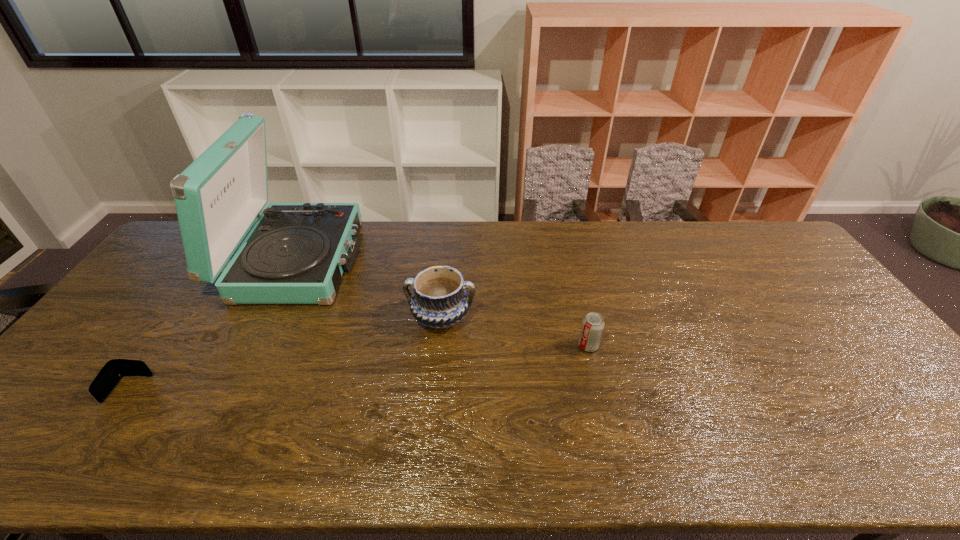
In order to click on record player in this screenshot , I will do `click(296, 253)`.

Locate an element on the screen. This screenshot has height=540, width=960. the third object from right to left is located at coordinates (296, 253).

Find the location of a particular element. This screenshot has width=960, height=540. the third object from left to right is located at coordinates pyautogui.click(x=440, y=300).

Identify the location of pottery. (440, 300).

Locate an element on the screen. the rightmost object is located at coordinates (593, 324).

Locate an element on the screen. Image resolution: width=960 pixels, height=540 pixels. the second shortest object is located at coordinates (593, 324).

Where is `wallet`? The height and width of the screenshot is (540, 960). wallet is located at coordinates (115, 369).

The width and height of the screenshot is (960, 540). What are the coordinates of `the leftmost object` in the screenshot? It's located at coord(115,369).

Where is `vacant area located on the face side of the tallest object`? vacant area located on the face side of the tallest object is located at coordinates (386, 260).

What are the coordinates of `free space located on the front of the third object from left to right` in the screenshot? It's located at (431, 434).